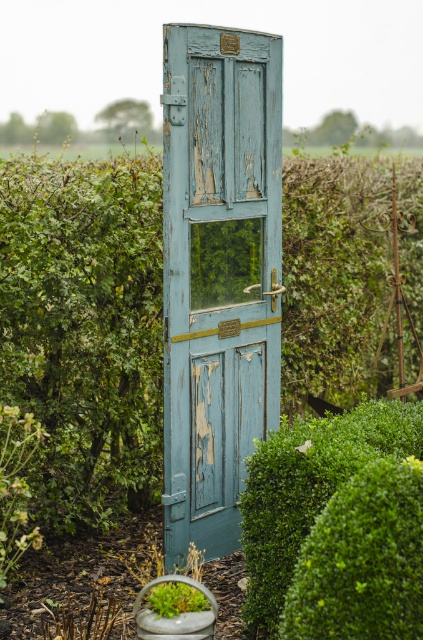
You are a landscape designer planning to replace the blue peeling paint door at center and the green leafy bush at center with new plants. Which object should you remove first if you want to preserve the larger one?

The blue peeling paint door at center occupies less space than the green leafy bush at center, so you should remove the blue peeling paint door at center first to preserve the larger green leafy bush at center.

You are standing in front of the rustic blue door in the garden. There are two points marked on the door. Which point is closer to you, point (189, 349) or point (400, 445)?

Point (189, 349) is closer to you because it is further to the viewer than point (400, 445).